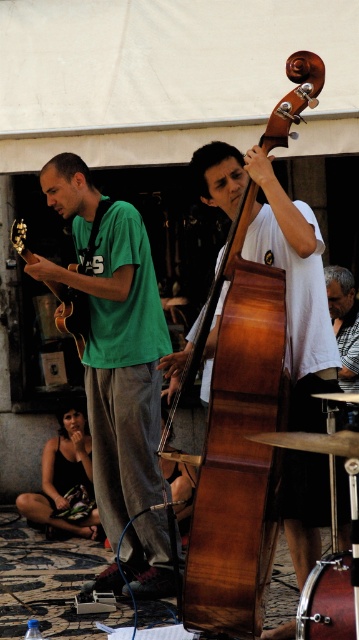
In the scene shown: You are a street performer who needs to set up your instruments. You have a wooden polished cello at center and a metallic silver drum at lower right. Which instrument should you place closer to the audience to ensure it is visible over the other?

The wooden polished cello at center is taller than the metallic silver drum at lower right, so you should place the wooden polished cello at center closer to the audience to ensure it is visible over the metallic silver drum at lower right.

You are a street performer who wants to carry both the wooden polished cello at center and the metallic silver drum at lower right to your next gig. If you have a car trunk that can only fit items up to the size of the larger object between them, which instrument should you prioritize packing first?

The wooden polished cello at center is larger than the metallic silver drum at lower right. Therefore, you should prioritize packing the wooden polished cello at center first to ensure it fits in the trunk.

You are a photographer trying to capture a photo of the musicians. You notice the green matte shirt at left and the black fabric dress at lower left in your frame. Which of these items is located to the right of the other in the image?

The green matte shirt at left is positioned on the right side of the black fabric dress at lower left, so the green matte shirt at left is to the right of the black fabric dress at lower left.